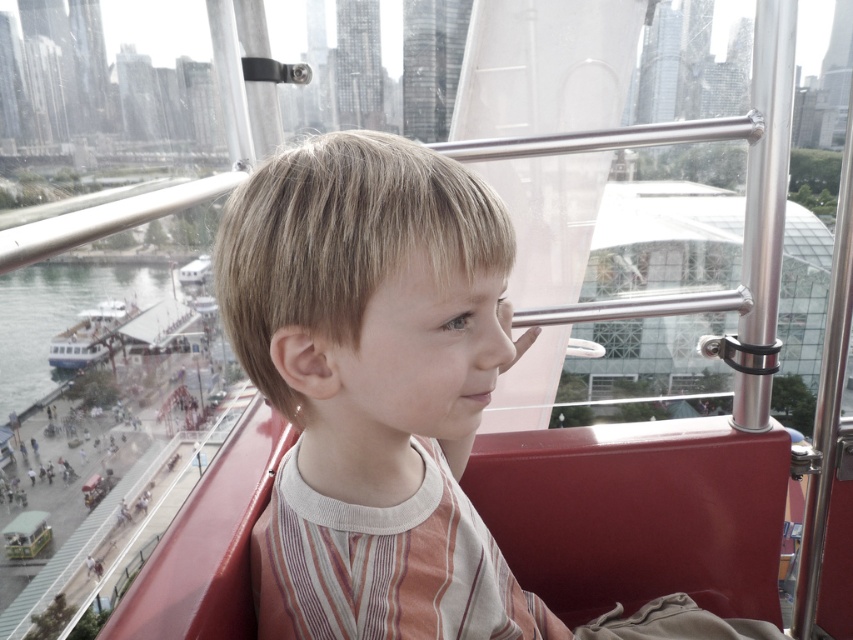
Is light brown hair at center further to the viewer compared to white matte boat at lower left?

No.

Is point (454, 316) closer to viewer compared to point (74, 369)?

That is True.

This screenshot has height=640, width=853. I want to click on light brown hair at center, so click(x=374, y=387).